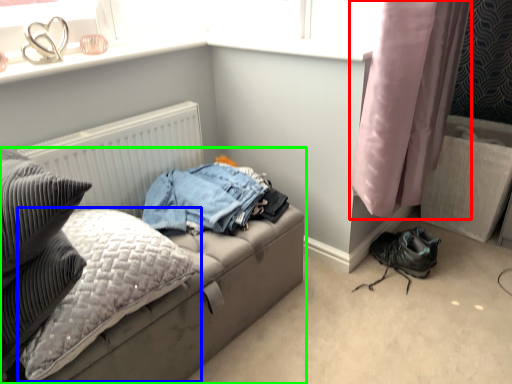
Question: Estimate the real-world distances between objects in this image. Which object is farther from curtain (highlighted by a red box), pillow (highlighted by a blue box) or studio couch (highlighted by a green box)?

Choices:
 (A) pillow
 (B) studio couch

Answer: (A)